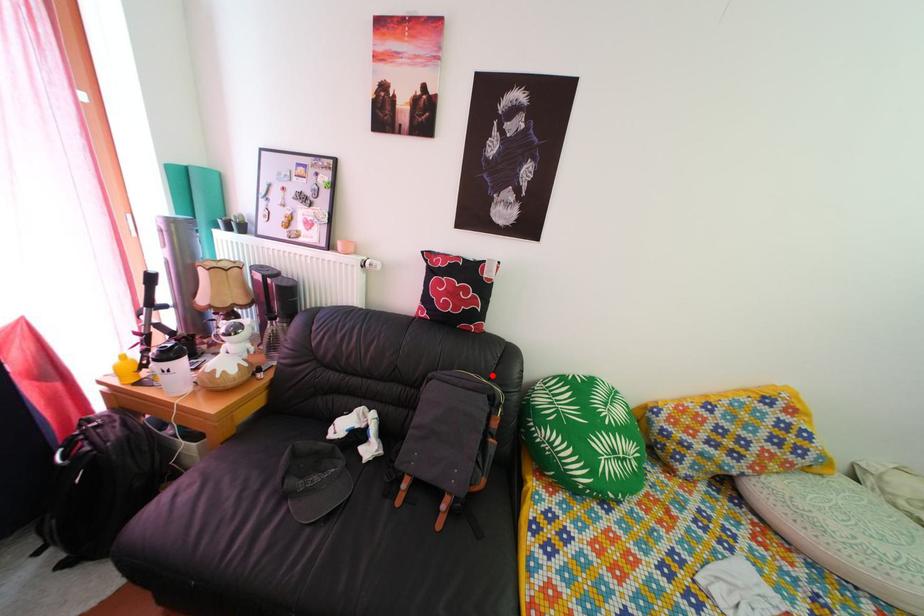
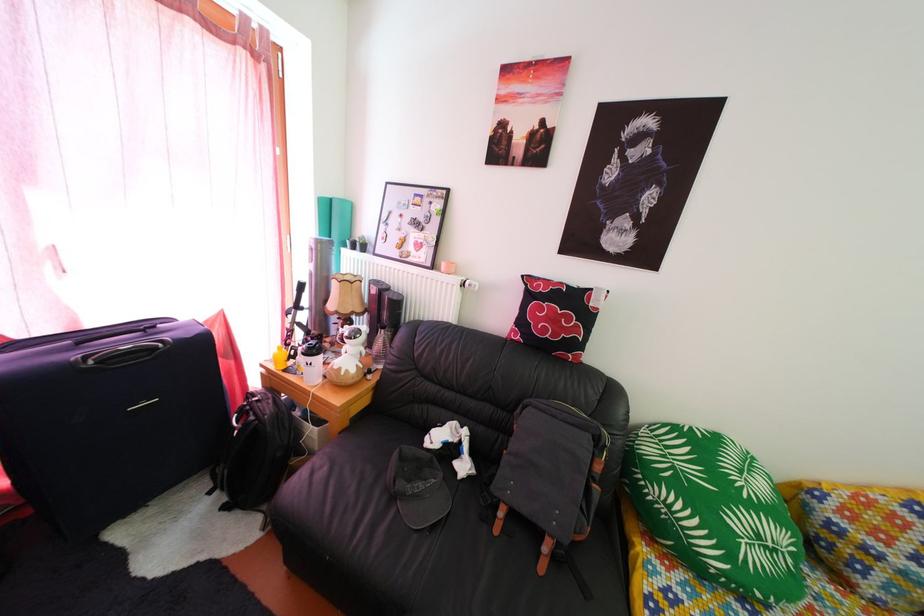
Locate, in the second image, the point that corresponds to the highlighted location in the first image.

(591, 410)